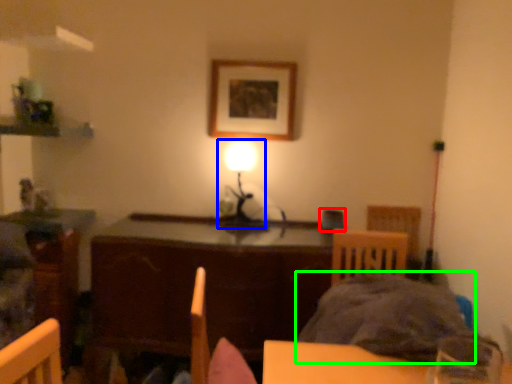
Question: Which is farther away from armchair (highlighted by a red box)? table lamp (highlighted by a blue box) or bedding (highlighted by a green box)?

Choices:
 (A) table lamp
 (B) bedding

Answer: (B)